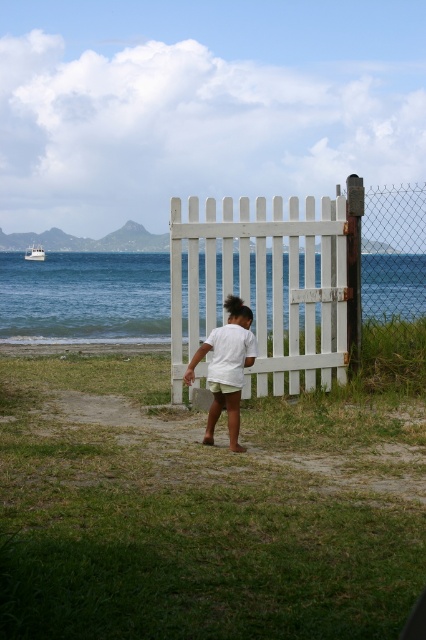
Question: Which object appears closest to the camera in this image?

Choices:
 (A) blue water at center
 (B) green grass at center
 (C) white matte shorts at center

Answer: (B)

Question: Does white wooden gate at center have a greater width compared to white matte shorts at center?

Choices:
 (A) yes
 (B) no

Answer: (B)

Question: Observing the image, what is the correct spatial positioning of green grass at center in reference to white matte shorts at center?

Choices:
 (A) below
 (B) above

Answer: (A)

Question: Where is blue water at center located in relation to white matte shorts at center in the image?

Choices:
 (A) above
 (B) below

Answer: (A)

Question: Among these objects, which one is nearest to the camera?

Choices:
 (A) white matte shorts at center
 (B) blue water at center
 (C) green grass at center
 (D) white glossy boat at upper left

Answer: (C)

Question: Which is farther from the white wooden gate at center?

Choices:
 (A) blue water at center
 (B) white matte shorts at center

Answer: (A)